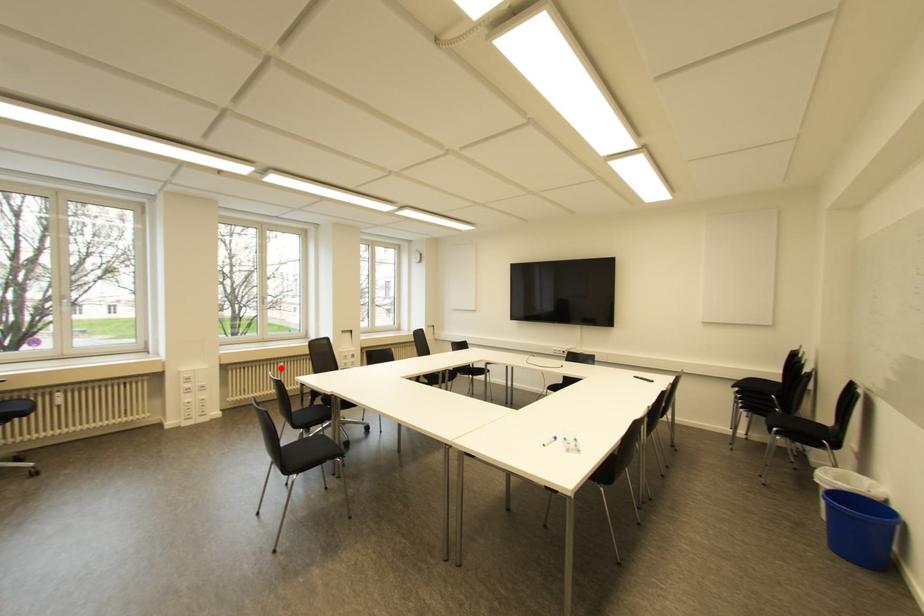
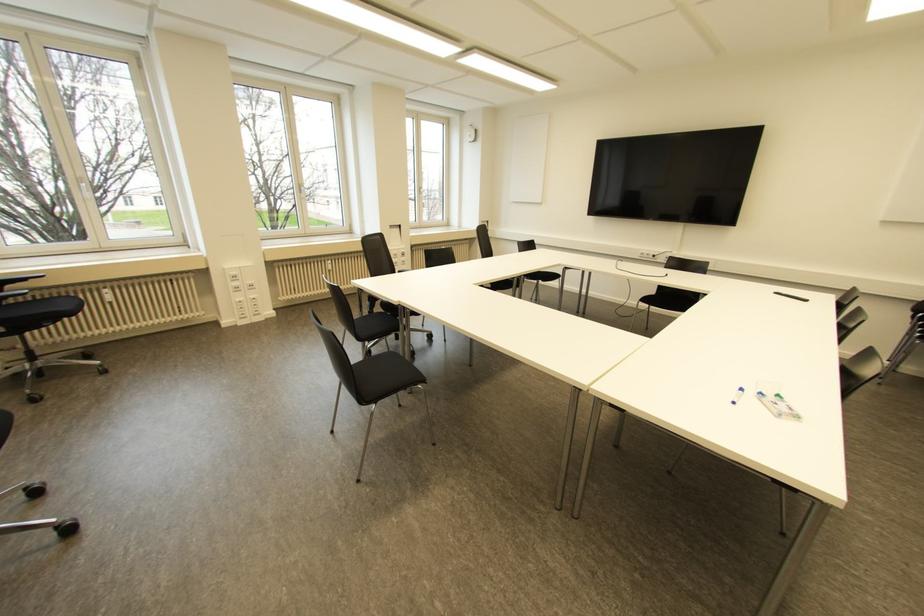
The point at the highlighted location is marked in the first image. Where is the corresponding point in the second image?

(330, 267)